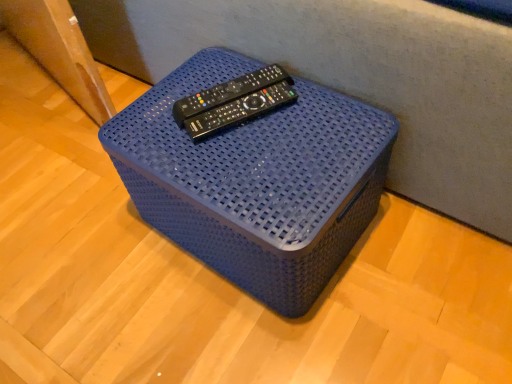
This screenshot has height=384, width=512. What do you see at coordinates (256, 180) in the screenshot? I see `blue woven basket at center` at bounding box center [256, 180].

The width and height of the screenshot is (512, 384). Find the location of `blue woven basket at center`. blue woven basket at center is located at coordinates (256, 180).

Locate an element on the screen. Image resolution: width=512 pixels, height=384 pixels. black plastic remote at center is located at coordinates (231, 94).

What do you see at coordinates (231, 94) in the screenshot? The image size is (512, 384). I see `black plastic remote at center` at bounding box center [231, 94].

This screenshot has height=384, width=512. In order to click on blue woven basket at center in this screenshot , I will do `click(256, 180)`.

Which object is positioned more to the left, black plastic remote at center or blue woven basket at center?

Positioned to the left is black plastic remote at center.

Does black plastic remote at center lie behind blue woven basket at center?

Yes, black plastic remote at center is further from the viewer.

Is point (251, 78) closer or farther from the camera than point (320, 140)?

Point (251, 78) is farther from the camera than point (320, 140).

From the image's perspective, which is above, black plastic remote at center or blue woven basket at center?

black plastic remote at center appears higher in the image.

From a real-world perspective, between black plastic remote at center and blue woven basket at center, who is vertically higher?

In real-world perspective, black plastic remote at center is above.

Considering the relative sizes of black plastic remote at center and blue woven basket at center in the image provided, is black plastic remote at center thinner than blue woven basket at center?

Correct, the width of black plastic remote at center is less than that of blue woven basket at center.

Does black plastic remote at center have a lesser height compared to blue woven basket at center?

Correct, black plastic remote at center is not as tall as blue woven basket at center.

Can you confirm if black plastic remote at center is bigger than blue woven basket at center?

Incorrect, black plastic remote at center is not larger than blue woven basket at center.

Choose the correct answer: Is black plastic remote at center inside blue woven basket at center or outside it?

black plastic remote at center is spatially situated outside blue woven basket at center.

In the scene shown: Is the surface of black plastic remote at center in direct contact with blue woven basket at center?

There is a gap between black plastic remote at center and blue woven basket at center.

Could you tell me if black plastic remote at center is facing blue woven basket at center?

No, black plastic remote at center is not facing towards blue woven basket at center.

How many degrees apart are the facing directions of black plastic remote at center and blue woven basket at center?

black plastic remote at center and blue woven basket at center are facing 28.1 degrees away from each other.

Measure the distance from black plastic remote at center to blue woven basket at center.

black plastic remote at center is 14.10 centimeters from blue woven basket at center.

Where is `remote that appears behind the blue woven basket at center`? This screenshot has height=384, width=512. remote that appears behind the blue woven basket at center is located at coordinates (231, 94).

Is blue woven basket at center at the left side of black plastic remote at center?

No.

Relative to black plastic remote at center, is blue woven basket at center in front or behind?

Clearly, blue woven basket at center is in front of black plastic remote at center.

Considering the points (273, 119) and (267, 66), which point is in front, point (273, 119) or point (267, 66)?

The point (273, 119) is closer to the camera.

From the image's perspective, is blue woven basket at center above black plastic remote at center?

No, from the image's perspective, blue woven basket at center is not on top of black plastic remote at center.

From a real-world perspective, is blue woven basket at center over black plastic remote at center?

No, from a real-world perspective, blue woven basket at center is not on top of black plastic remote at center.

In terms of width, does blue woven basket at center look wider or thinner when compared to black plastic remote at center?

blue woven basket at center is wider than black plastic remote at center.

Does blue woven basket at center have a lesser height compared to black plastic remote at center?

No.

Which of these two, blue woven basket at center or black plastic remote at center, is bigger?

Bigger between the two is blue woven basket at center.

Is blue woven basket at center inside the boundaries of black plastic remote at center, or outside?

blue woven basket at center is located beyond the bounds of black plastic remote at center.

Is blue woven basket at center positioned far away from black plastic remote at center?

They are positioned close to each other.

Could you tell me if blue woven basket at center is facing black plastic remote at center?

No, blue woven basket at center is not turned towards black plastic remote at center.

How much distance is there between blue woven basket at center and black plastic remote at center?

blue woven basket at center and black plastic remote at center are 5.55 inches apart.

Image resolution: width=512 pixels, height=384 pixels. In order to click on furniture lying on the right of black plastic remote at center in this screenshot , I will do `click(256, 180)`.

Locate an element on the screen. The width and height of the screenshot is (512, 384). remote above the blue woven basket at center (from a real-world perspective) is located at coordinates (231, 94).

What are the coordinates of `furniture in front of the black plastic remote at center` in the screenshot? It's located at tap(256, 180).